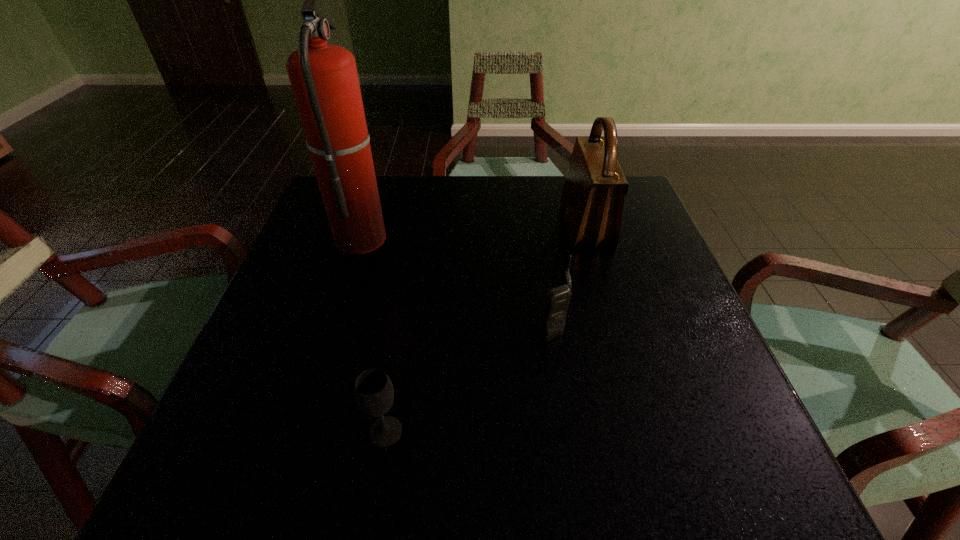
This screenshot has height=540, width=960. I want to click on object positioned at the right edge, so coord(592,200).

This screenshot has width=960, height=540. I want to click on object located in the far left corner section of the desktop, so click(x=324, y=79).

Find the location of a particular element. object that is at the far right corner is located at coordinates (592, 200).

Identify the location of free space at the far edge of the desktop. (461, 198).

Where is `vacant region at the near edge of the desktop`? The image size is (960, 540). vacant region at the near edge of the desktop is located at coordinates (307, 496).

Locate an element on the screen. vacant area at the left edge of the desktop is located at coordinates (233, 428).

Find the location of a particular element. The image size is (960, 540). vacant space at the right edge of the desktop is located at coordinates (601, 249).

The width and height of the screenshot is (960, 540). What are the coordinates of `vacant space at the far left corner of the desktop` in the screenshot? It's located at (315, 215).

In the image, there is a desktop. Identify the location of blank space at the near right corner. The width and height of the screenshot is (960, 540). [738, 438].

Locate an element on the screen. This screenshot has width=960, height=540. empty space between the third object from left to right and the fire extinguisher is located at coordinates (456, 282).